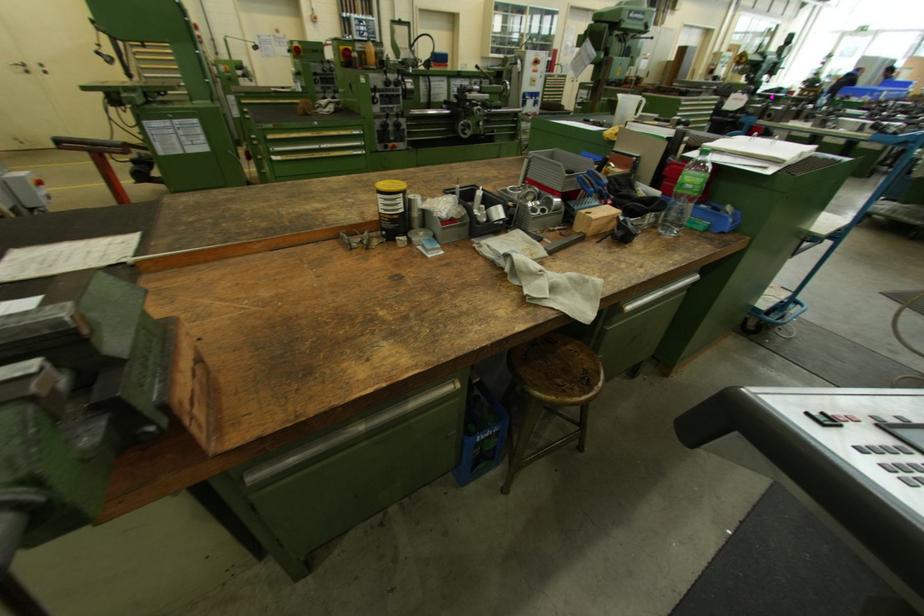
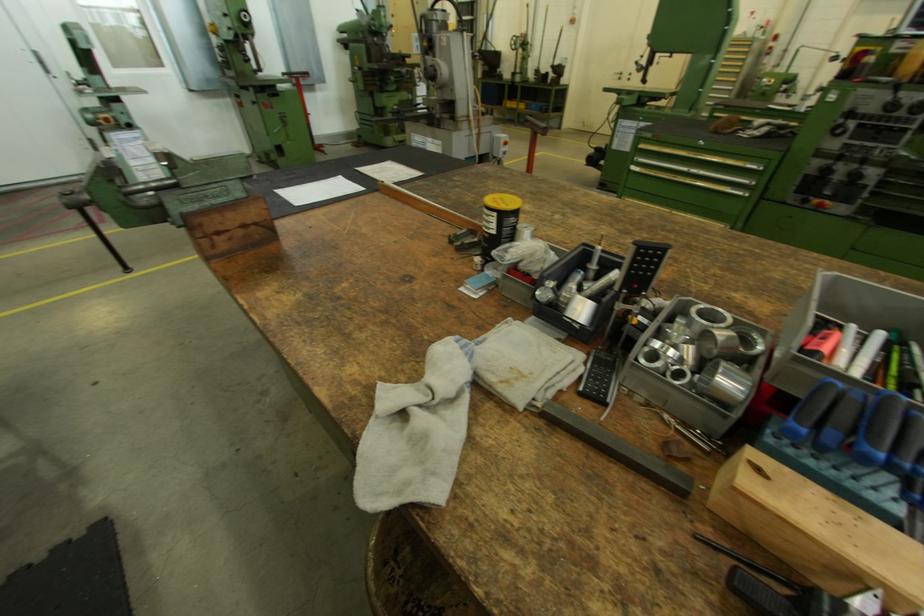
Where in the second image is the point corresponding to (365,145) from the first image?

(752, 183)